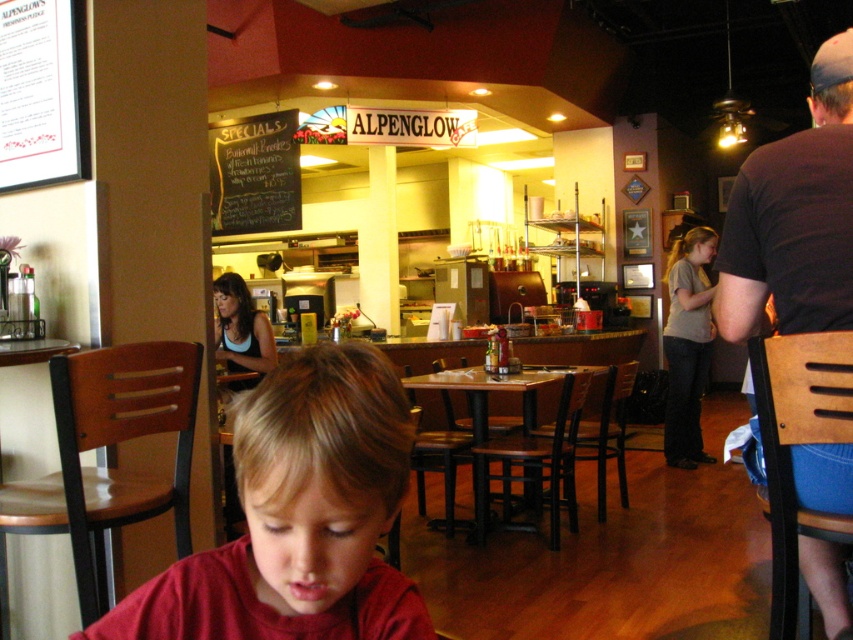
This screenshot has width=853, height=640. Describe the element at coordinates (793, 218) in the screenshot. I see `dark brown leather chair at right` at that location.

Is point (764, 300) less distant than point (683, 436)?

Yes, it is in front of point (683, 436).

Is point (778, 282) positioned in front of point (706, 336)?

Yes.

At what (x,y) coordinates should I click in order to perform the action: click on dark brown leather chair at right. Please return your answer as a coordinate pair (x, y). This screenshot has height=640, width=853. Looking at the image, I should click on (793, 218).

I want to click on black chalkboard specials at upper center, so click(x=254, y=173).

Is the position of black chalkboard specials at upper center less distant than that of brown wood table at center?

No, it is not.

Is point (252, 173) positioned in front of point (518, 387)?

That is False.

Image resolution: width=853 pixels, height=640 pixels. Identify the location of black chalkboard specials at upper center. (254, 173).

Can you confirm if matte red shirt at center is bigger than brown wood table at center?

Incorrect, matte red shirt at center is not larger than brown wood table at center.

Which is behind, point (341, 522) or point (531, 387)?

Point (531, 387)

This screenshot has height=640, width=853. Find the location of `matte red shirt at center`. matte red shirt at center is located at coordinates (299, 516).